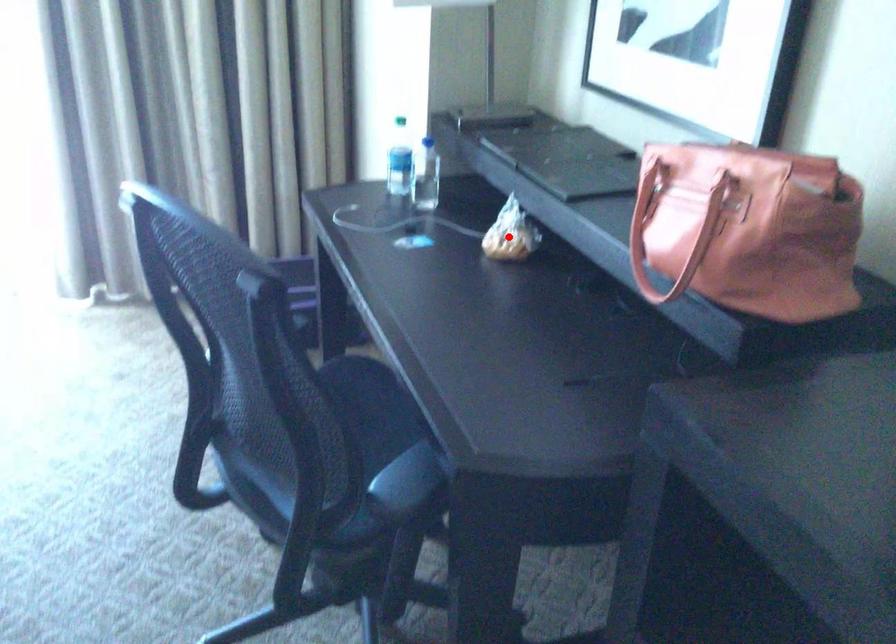
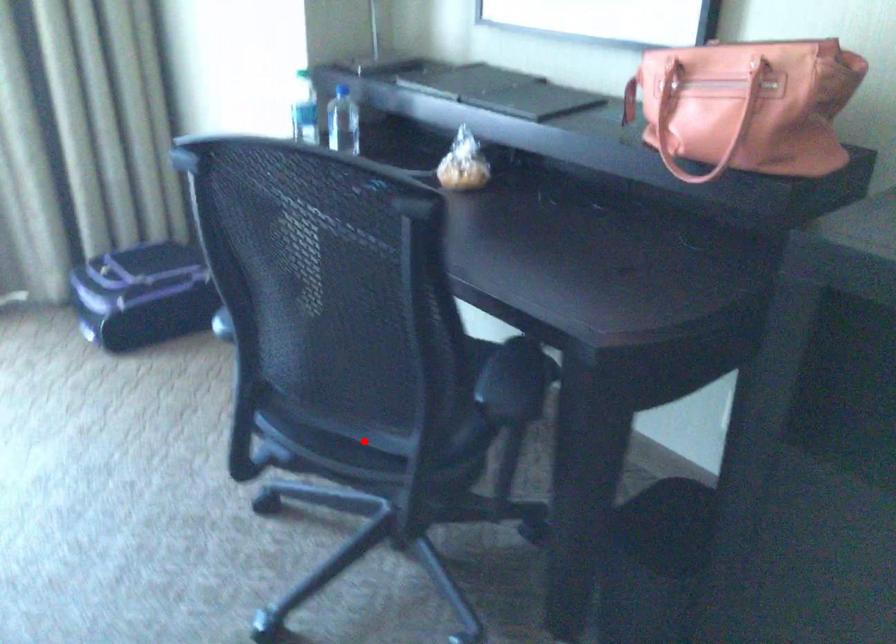
I am providing you with two images of the same scene from different viewpoints. A red point is marked on the first image and another point is marked on the second image. Do the highlighted points in image1 and image2 indicate the same real-world spot?

No